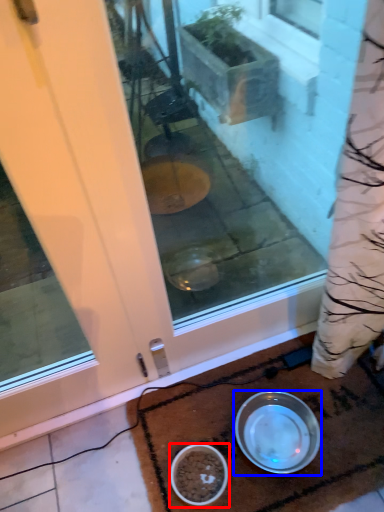
Question: Among these objects, which one is nearest to the camera, bowl (highlighted by a red box) or bowl (highlighted by a blue box)?

Choices:
 (A) bowl
 (B) bowl

Answer: (A)